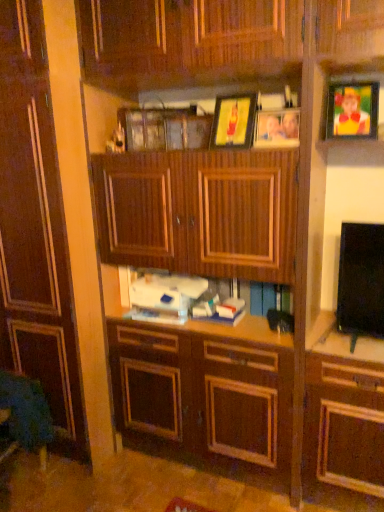
Question: Does dark wood cabinet at center have a lesser height compared to wooden picture frame at upper center, the first picture frame viewed from the left?

Choices:
 (A) yes
 (B) no

Answer: (B)

Question: Is dark wood cabinet at center positioned with its back to wooden picture frame at upper center, acting as the 3th picture frame starting from the right?

Choices:
 (A) no
 (B) yes

Answer: (A)

Question: Can you confirm if dark wood cabinet at center is wider than wooden picture frame at upper center, acting as the 3th picture frame starting from the right?

Choices:
 (A) yes
 (B) no

Answer: (A)

Question: Considering the relative sizes of dark wood cabinet at center and wooden picture frame at upper center, the first picture frame viewed from the left, in the image provided, is dark wood cabinet at center taller than wooden picture frame at upper center, the first picture frame viewed from the left,?

Choices:
 (A) yes
 (B) no

Answer: (A)

Question: Considering the relative sizes of dark wood cabinet at center and wooden picture frame at upper center, acting as the 3th picture frame starting from the right, in the image provided, is dark wood cabinet at center smaller than wooden picture frame at upper center, acting as the 3th picture frame starting from the right,?

Choices:
 (A) yes
 (B) no

Answer: (B)

Question: Is dark wood cabinet at center with wooden picture frame at upper center, the first picture frame viewed from the left?

Choices:
 (A) no
 (B) yes

Answer: (A)

Question: Is wooden picture frame at upper center, arranged as the 2th picture frame when viewed from the left, in front of wooden picture frame at upper center, acting as the 3th picture frame starting from the right?

Choices:
 (A) yes
 (B) no

Answer: (A)

Question: From the image's perspective, does wooden picture frame at upper center, which ranks as the second picture frame in right-to-left order, appear higher than wooden picture frame at upper center, acting as the 3th picture frame starting from the right?

Choices:
 (A) no
 (B) yes

Answer: (A)

Question: Can you confirm if wooden picture frame at upper center, which ranks as the second picture frame in right-to-left order, is positioned to the right of wooden picture frame at upper center, the first picture frame viewed from the left?

Choices:
 (A) yes
 (B) no

Answer: (A)

Question: Can you confirm if wooden picture frame at upper center, which ranks as the second picture frame in right-to-left order, is bigger than wooden picture frame at upper center, acting as the 3th picture frame starting from the right?

Choices:
 (A) no
 (B) yes

Answer: (A)

Question: Considering the relative positions of wooden picture frame at upper center, which ranks as the second picture frame in right-to-left order, and wooden picture frame at upper center, acting as the 3th picture frame starting from the right, in the image provided, is wooden picture frame at upper center, which ranks as the second picture frame in right-to-left order, to the left of wooden picture frame at upper center, acting as the 3th picture frame starting from the right, from the viewer's perspective?

Choices:
 (A) no
 (B) yes

Answer: (A)

Question: Considering the relative sizes of wooden picture frame at upper center, which ranks as the second picture frame in right-to-left order, and wooden picture frame at upper center, the first picture frame viewed from the left, in the image provided, is wooden picture frame at upper center, which ranks as the second picture frame in right-to-left order, taller than wooden picture frame at upper center, the first picture frame viewed from the left,?

Choices:
 (A) no
 (B) yes

Answer: (A)

Question: Is wooden picture frame at upper center, the first picture frame viewed from the left, beside matte plastic picture frame at upper right, which is counted as the 1th picture frame, starting from the right?

Choices:
 (A) yes
 (B) no

Answer: (B)